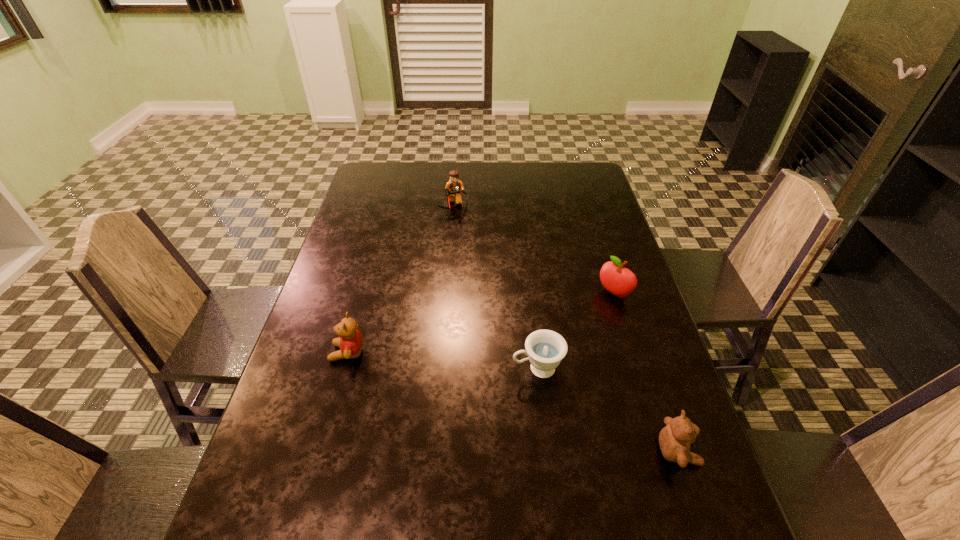
Identify which object is the fourth closest to the fourth nearest object. Please provide its 2D coordinates. Your answer should be formatted as a tuple, i.e. [(x, y)], where the tuple contains the x and y coordinates of a point satisfying the conditions above.

[(351, 342)]

Find the location of `vacant area that satisfies the following two spatial constraints: 1. on the front side of the fourth object from right to left; 2. on the right side of the fourth nearest object`. vacant area that satisfies the following two spatial constraints: 1. on the front side of the fourth object from right to left; 2. on the right side of the fourth nearest object is located at coordinates (446, 293).

The height and width of the screenshot is (540, 960). I want to click on vacant area in the image that satisfies the following two spatial constraints: 1. on the back side of the apple; 2. on the left side of the shortest object, so click(x=529, y=293).